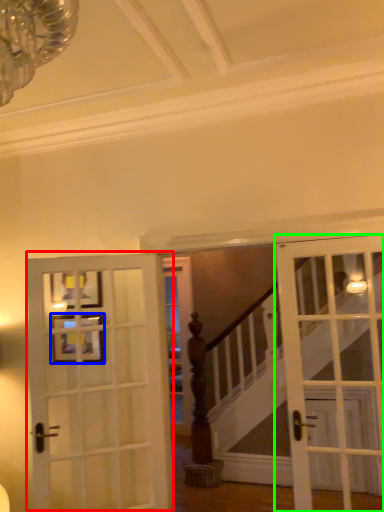
Question: Which is nearer to the door (highlighted by a red box)? picture frame (highlighted by a blue box) or door (highlighted by a green box).

Choices:
 (A) picture frame
 (B) door

Answer: (A)